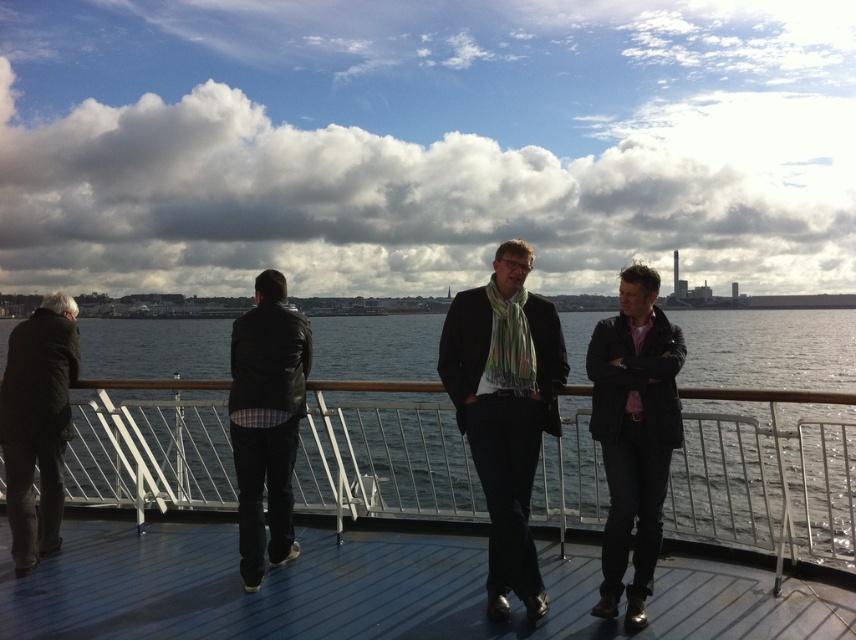
What do you see at coordinates (768, 435) in the screenshot? The height and width of the screenshot is (640, 856). I see `blue water at center` at bounding box center [768, 435].

Which is behind, point (227, 362) or point (61, 420)?

The point (227, 362) is behind.

The height and width of the screenshot is (640, 856). What do you see at coordinates (768, 435) in the screenshot?
I see `blue water at center` at bounding box center [768, 435].

Where is `blue water at center`? blue water at center is located at coordinates (768, 435).

Can you confirm if matte black jacket at center is positioned to the right of matte black jacket at right?

In fact, matte black jacket at center is to the left of matte black jacket at right.

From the picture: Who is positioned more to the right, matte black jacket at center or matte black jacket at right?

Positioned to the right is matte black jacket at right.

Image resolution: width=856 pixels, height=640 pixels. What do you see at coordinates (504, 410) in the screenshot?
I see `matte black jacket at center` at bounding box center [504, 410].

Identify the location of matte black jacket at center. Image resolution: width=856 pixels, height=640 pixels. (504, 410).

Is blue water at center shorter than smooth wooden deck at center?

No.

Is blue water at center taller than smooth wooden deck at center?

Yes, blue water at center is taller than smooth wooden deck at center.

What do you see at coordinates (768, 435) in the screenshot? I see `blue water at center` at bounding box center [768, 435].

This screenshot has width=856, height=640. I want to click on blue water at center, so click(x=768, y=435).